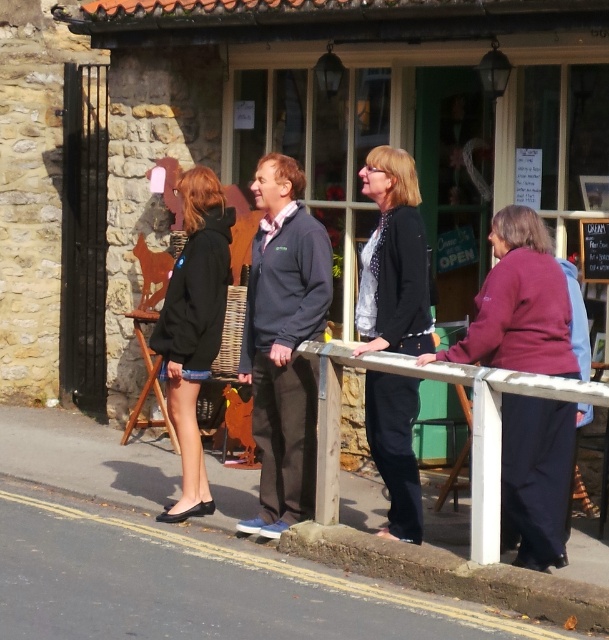
Can you confirm if white wood rail at center is positioned to the left of concrete curb at lower center?

Incorrect, white wood rail at center is not on the left side of concrete curb at lower center.

Image resolution: width=609 pixels, height=640 pixels. What are the coordinates of `white wood rail at center` in the screenshot? It's located at (473, 426).

Between dark blue fleece jacket at center and black matte jacket at left, which one has more height?

With more height is dark blue fleece jacket at center.

Locate an element on the screen. dark blue fleece jacket at center is located at coordinates (283, 342).

This screenshot has width=609, height=640. I want to click on dark blue fleece jacket at center, so click(283, 342).

Is point (561, 436) farther from viewer compared to point (275, 381)?

No, it is in front of (275, 381).

Which is more to the left, purple fleece jacket at center or dark blue fleece jacket at center?

From the viewer's perspective, dark blue fleece jacket at center appears more on the left side.

Is point (547, 269) positioned before point (280, 372)?

That is True.

The width and height of the screenshot is (609, 640). I want to click on purple fleece jacket at center, so click(518, 305).